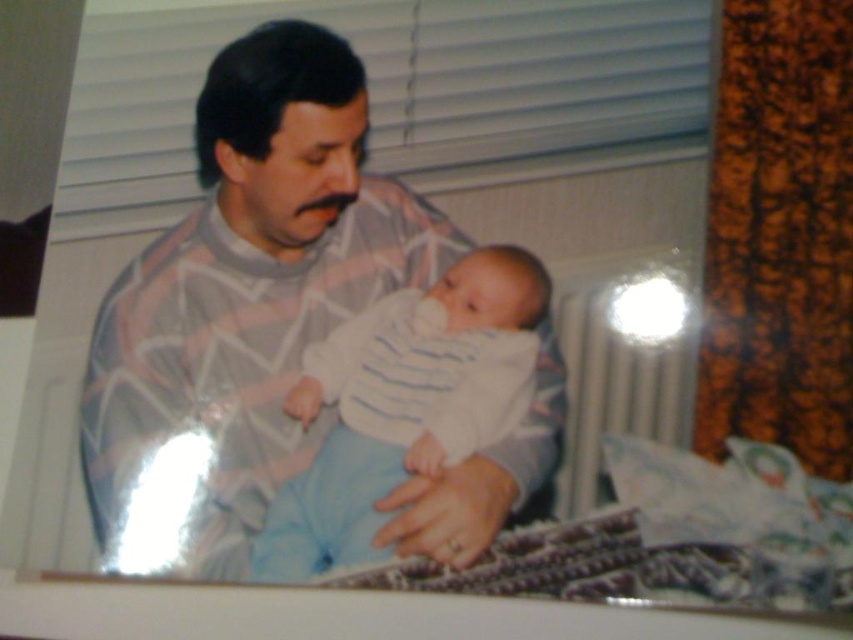
Does striped sweater at center lie behind white striped fabric baby at center?

No, it is in front of white striped fabric baby at center.

Between point (556, 449) and point (308, 513), which one is positioned behind?

Point (556, 449)

Find the location of `striped sweater at center`. striped sweater at center is located at coordinates tap(251, 282).